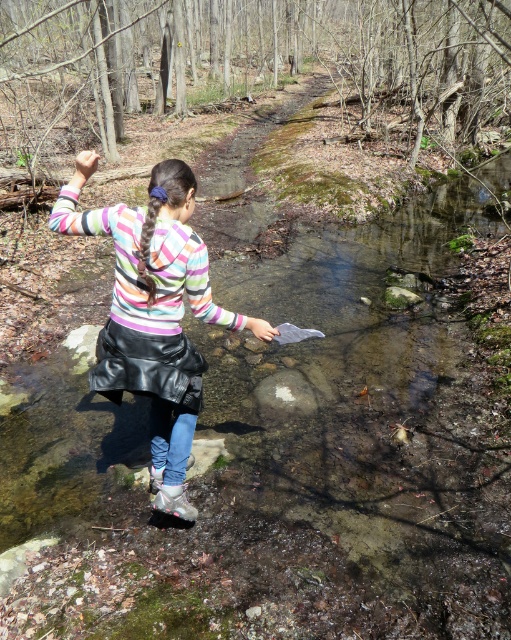
Question: Does leather skirt at center have a greater width compared to matte gray boot at lower center?

Choices:
 (A) no
 (B) yes

Answer: (B)

Question: Can you confirm if leather skirt at center is bigger than matte gray boot at lower center?

Choices:
 (A) no
 (B) yes

Answer: (B)

Question: Which object is farther from the camera taking this photo?

Choices:
 (A) leather skirt at center
 (B) matte gray boot at lower center

Answer: (B)

Question: Which point is closer to the camera?

Choices:
 (A) (160, 496)
 (B) (176, 205)

Answer: (B)

Question: From the image, what is the correct spatial relationship of leather skirt at center in relation to matte gray boot at lower center?

Choices:
 (A) above
 (B) below

Answer: (A)

Question: Which point is farther to the camera?

Choices:
 (A) matte gray boot at lower center
 (B) leather skirt at center

Answer: (A)